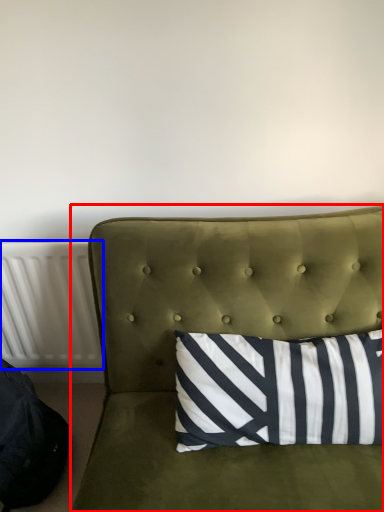
Question: Which point is closer to the camera, studio couch (highlighted by a red box) or radiator (highlighted by a blue box)?

Choices:
 (A) studio couch
 (B) radiator

Answer: (A)